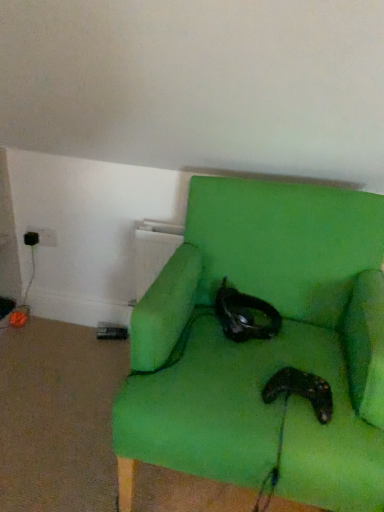
Question: From the image's perspective, is black matte controller at lower center above or below black matte cat at center?

Choices:
 (A) below
 (B) above

Answer: (A)

Question: Considering the positions of black matte controller at lower center and black matte cat at center in the image, is black matte controller at lower center taller or shorter than black matte cat at center?

Choices:
 (A) short
 (B) tall

Answer: (A)

Question: Based on their relative distances, which object is farther from the green fabric chair at center?

Choices:
 (A) black matte controller at lower center
 (B) black matte cat at center

Answer: (A)

Question: Considering the real-world distances, which object is farthest from the black matte controller at lower center?

Choices:
 (A) black matte cat at center
 (B) green fabric chair at center

Answer: (A)